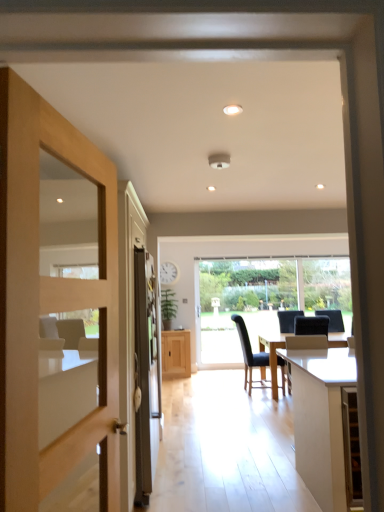
This screenshot has width=384, height=512. Identify the location of light wood door at left. (49, 302).

This screenshot has height=512, width=384. Describe the element at coordinates (176, 354) in the screenshot. I see `light oak cabinet at center` at that location.

Identify the location of light wood door at left. (x=49, y=302).

Consider the image. From a real-world perspective, is dark blue fabric chair at center, which ranks as the 2th chair in right-to-left order, positioned above or below white glossy table at lower right?

dark blue fabric chair at center, which ranks as the 2th chair in right-to-left order, is above white glossy table at lower right.

In the image, is dark blue fabric chair at center, which is the first chair from left to right, on the left side or the right side of white glossy table at lower right?

Clearly, dark blue fabric chair at center, which is the first chair from left to right, is on the left of white glossy table at lower right in the image.

Which is farther, (251, 377) or (291, 368)?

The point (251, 377) is behind.

Is dark blue fabric chair at center, which is the first chair from left to right, far from white glossy table at lower right?

Absolutely, dark blue fabric chair at center, which is the first chair from left to right, is distant from white glossy table at lower right.

Is white glossy table at lower right at the right side of dark blue fabric chair at center, which is the first chair from left to right?

Indeed, white glossy table at lower right is positioned on the right side of dark blue fabric chair at center, which is the first chair from left to right.

Looking at their sizes, would you say white glossy table at lower right is wider or thinner than dark blue fabric chair at center, which ranks as the 2th chair in right-to-left order?

white glossy table at lower right is wider than dark blue fabric chair at center, which ranks as the 2th chair in right-to-left order.

From the image's perspective, is white glossy table at lower right located beneath dark blue fabric chair at center, which ranks as the 2th chair in right-to-left order?

No, from the image's perspective, white glossy table at lower right is not below dark blue fabric chair at center, which ranks as the 2th chair in right-to-left order.

How much distance is there between white glossy table at lower right and dark blue fabric chair at center, which is the first chair from left to right?

The distance of white glossy table at lower right from dark blue fabric chair at center, which is the first chair from left to right, is 7.94 feet.

Which point is more distant from viewer, (22,244) or (324,340)?

The point (324,340) is farther from the camera.

How far apart are light wood door at left and black leather chair at center, which is the second chair from left to right?

light wood door at left is 9.82 feet away from black leather chair at center, which is the second chair from left to right.

Is light wood door at left facing towards black leather chair at center, which is counted as the first chair, starting from the right?

No, light wood door at left does not turn towards black leather chair at center, which is counted as the first chair, starting from the right.

From a real-world perspective, is black leather chair at center, which is counted as the first chair, starting from the right, positioned over white glossy table at lower right based on gravity?

Yes.

How different are the orientations of black leather chair at center, which is the second chair from left to right, and white glossy table at lower right in degrees?

1.61 degrees separate the facing orientations of black leather chair at center, which is the second chair from left to right, and white glossy table at lower right.

Considering the relative positions of black leather chair at center, which is counted as the first chair, starting from the right, and white glossy table at lower right in the image provided, is black leather chair at center, which is counted as the first chair, starting from the right, to the left of white glossy table at lower right from the viewer's perspective?

No.

Does black leather chair at center, which is counted as the first chair, starting from the right, have a lesser width compared to white glossy table at lower right?

Indeed, black leather chair at center, which is counted as the first chair, starting from the right, has a lesser width compared to white glossy table at lower right.

Locate an element on the screen. cabinetry on the left of transparent glass window at center is located at coordinates (176, 354).

How different are the orientations of transparent glass window at center and light oak cabinet at center in degrees?

transparent glass window at center and light oak cabinet at center are facing 0.352 degrees away from each other.

Based on the photo, considering the positions of objects transparent glass window at center and light oak cabinet at center in the image provided, who is more to the left, transparent glass window at center or light oak cabinet at center?

Positioned to the left is light oak cabinet at center.

Considering the positions of objects transparent glass window at center and light oak cabinet at center in the image provided, who is behind, transparent glass window at center or light oak cabinet at center?

transparent glass window at center is behind.

Which of these two, black leather chair at center, which is the second chair from left to right, or dark blue fabric chair at center, which ranks as the 2th chair in right-to-left order, is smaller?

Smaller between the two is black leather chair at center, which is the second chair from left to right.

Identify the location of chair on the left of black leather chair at center, which is counted as the first chair, starting from the right. (250, 356).

Could you tell me if black leather chair at center, which is the second chair from left to right, is facing dark blue fabric chair at center, which is the first chair from left to right?

No, black leather chair at center, which is the second chair from left to right, is not oriented towards dark blue fabric chair at center, which is the first chair from left to right.

Does black leather chair at center, which is the second chair from left to right, appear on the right side of dark blue fabric chair at center, which is the first chair from left to right?

Correct, you'll find black leather chair at center, which is the second chair from left to right, to the right of dark blue fabric chair at center, which is the first chair from left to right.

From the image's perspective, is transparent glass window at center located above light wood door at left?

Actually, transparent glass window at center appears below light wood door at left in the image.

Is transparent glass window at center bigger than light wood door at left?

Correct, transparent glass window at center is larger in size than light wood door at left.

Do you think transparent glass window at center is within light wood door at left, or outside of it?

transparent glass window at center is spatially situated outside light wood door at left.

You are a GUI agent. You are given a task and a screenshot of the screen. Output one action in this format:
    pyautogui.click(x=<x>, y=<y>)
    Task: Click on the table on the right of dark blue fabric chair at center, which ranks as the 2th chair in right-to-left order
    The width and height of the screenshot is (384, 512).
    Given the screenshot: What is the action you would take?
    pyautogui.click(x=321, y=420)

From a real-world perspective, count 1st chairs upward from the white glossy table at lower right and point to it. Please provide its 2D coordinates.

[(250, 356)]

From the image, which object appears to be farther from black leather chair at center, which is counted as the first chair, starting from the right, light wood door at left or metallic silver screen door at left?

light wood door at left.

Considering their positions, is white glossy table at lower right positioned further to black leather chair at center, which is counted as the first chair, starting from the right, than light oak cabinet at center?

light oak cabinet at center.

Estimate the real-world distances between objects in this image. Which object is further from light wood door at left, white glossy table at lower right or dark blue fabric chair at center, which is the first chair from left to right?

dark blue fabric chair at center, which is the first chair from left to right, lies further to light wood door at left than the other object.

Looking at the image, which one is located closer to black leather chair at center, which is counted as the first chair, starting from the right, transparent glass window at center or metallic silver screen door at left?

metallic silver screen door at left.

Which object lies nearer to the anchor point black leather chair at center, which is counted as the first chair, starting from the right, light oak cabinet at center or white glossy table at lower right?

The object closer to black leather chair at center, which is counted as the first chair, starting from the right, is white glossy table at lower right.

Looking at the image, which one is located further to metallic silver screen door at left, black leather chair at center, which is the second chair from left to right, or light wood door at left?

black leather chair at center, which is the second chair from left to right, lies further to metallic silver screen door at left than the other object.

Estimate the real-world distances between objects in this image. Which object is closer to light wood door at left, metallic silver screen door at left or white glossy table at lower right?

Answer: Among the two, metallic silver screen door at left is located nearer to light wood door at left.

Looking at the image, which one is located closer to light oak cabinet at center, black leather chair at center, which is the second chair from left to right, or light wood door at left?

The object closer to light oak cabinet at center is black leather chair at center, which is the second chair from left to right.

Locate an element on the screen. The width and height of the screenshot is (384, 512). cabinetry between metallic silver screen door at left and transparent glass window at center along the z-axis is located at coordinates (176, 354).

Where is `table between light wood door at left and light oak cabinet at center along the z-axis`? The height and width of the screenshot is (512, 384). table between light wood door at left and light oak cabinet at center along the z-axis is located at coordinates (321, 420).

Locate an element on the screen. screen door between white glossy table at lower right and light oak cabinet at center in the front-back direction is located at coordinates (128, 330).

Where is `cabinetry between light wood door at left and transparent glass window at center in the front-back direction`? This screenshot has width=384, height=512. cabinetry between light wood door at left and transparent glass window at center in the front-back direction is located at coordinates (176, 354).